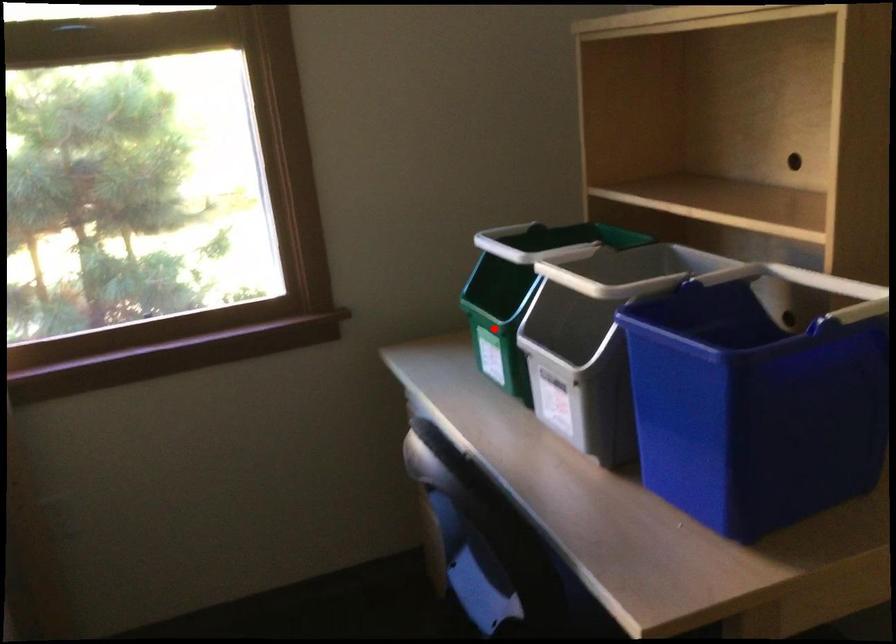
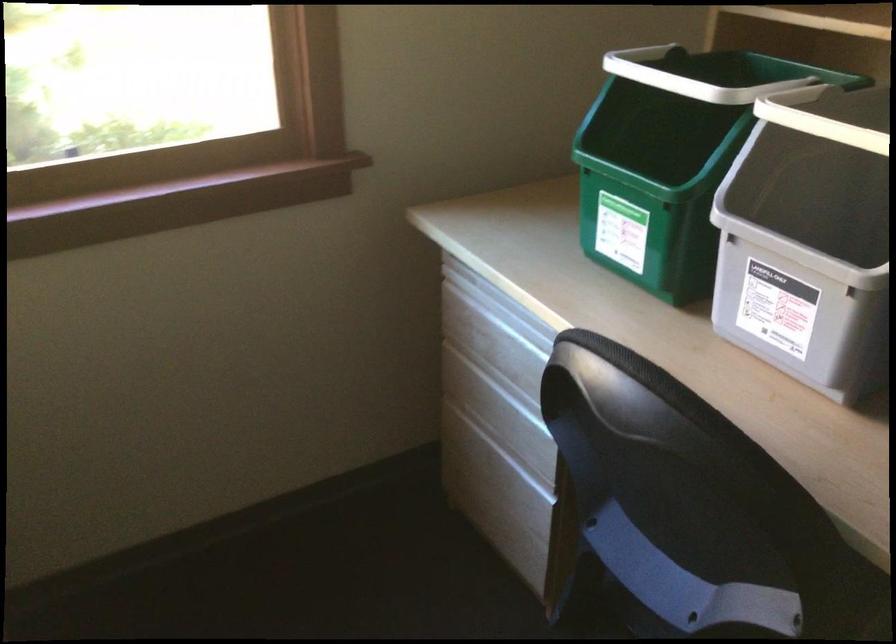
Where in the second image is the point corresponding to the highlighted location from the first image?

(652, 194)